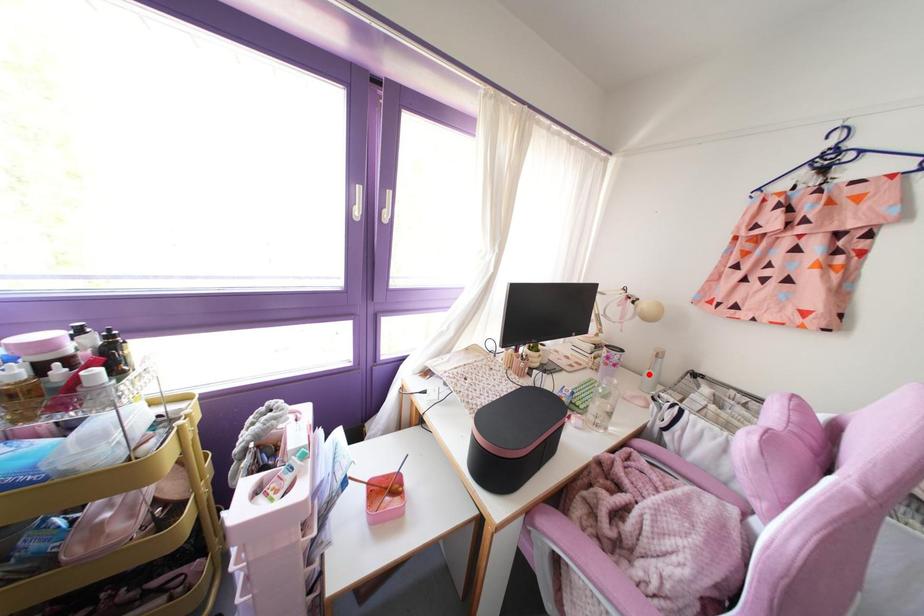
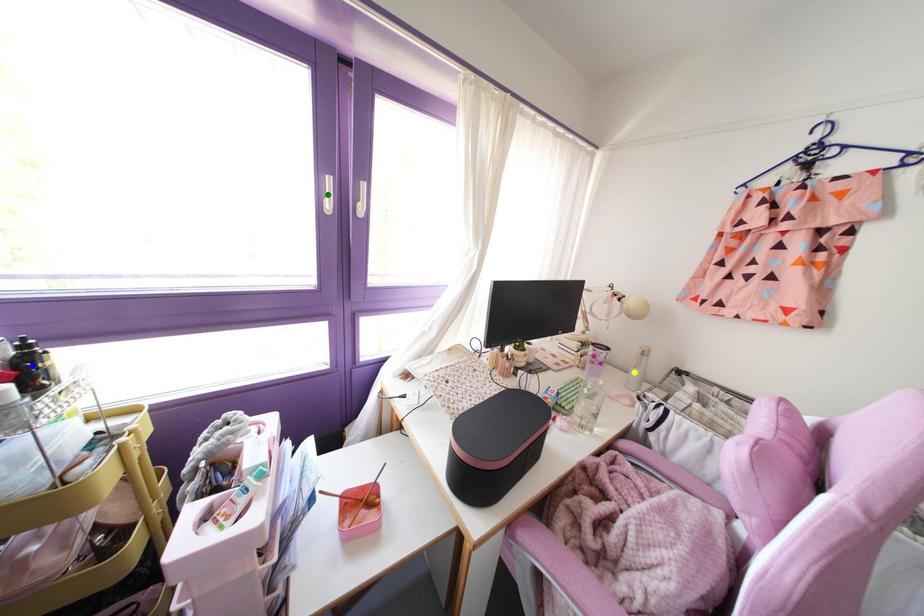
Question: I am providing you with two images of the same scene from different viewpoints. A red point is marked on the first image. You are given multiple points on the second image. Can you choose the point in image 2 that corresponds to the point in image 1?

Choices:
 (A) blue point
 (B) green point
 (C) yellow point

Answer: (C)